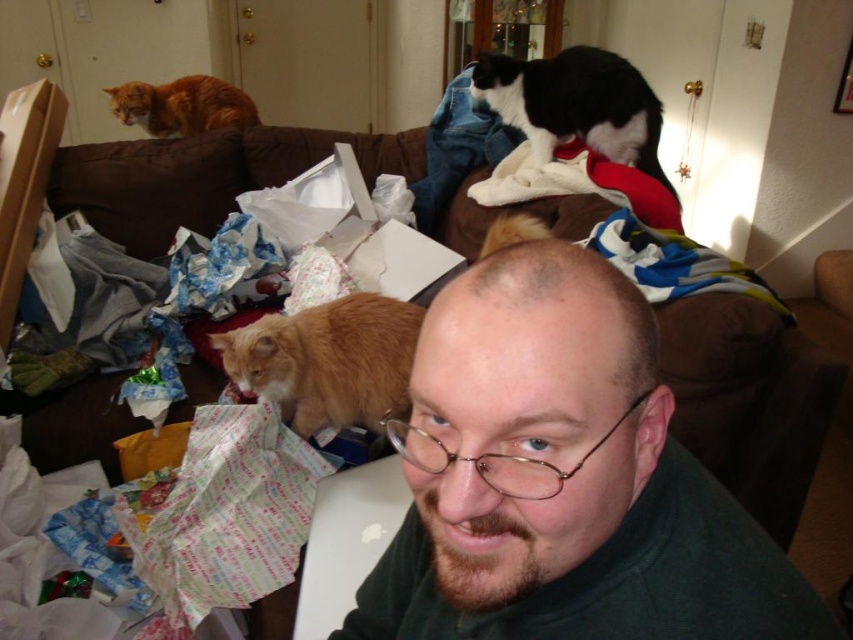
Question: Which object appears farthest from the camera in this image?

Choices:
 (A) orange fur cat at lower left
 (B) green matte shirt at center
 (C) brown fabric couch at center

Answer: (C)

Question: Does green matte shirt at center have a larger size compared to orange fur cat at upper left?

Choices:
 (A) no
 (B) yes

Answer: (B)

Question: Can you confirm if green matte shirt at center is bigger than black and white fur at upper center?

Choices:
 (A) no
 (B) yes

Answer: (A)

Question: Which is nearer to the brown fabric couch at center?

Choices:
 (A) black and white fur at upper center
 (B) orange fur cat at upper left
 (C) orange fur cat at lower left

Answer: (B)

Question: Does orange fur cat at lower left appear on the left side of black and white fur at upper center?

Choices:
 (A) yes
 (B) no

Answer: (A)

Question: Which object is the farthest from the black and white fur at upper center?

Choices:
 (A) orange fur cat at upper left
 (B) brown fabric couch at center
 (C) green matte shirt at center

Answer: (C)